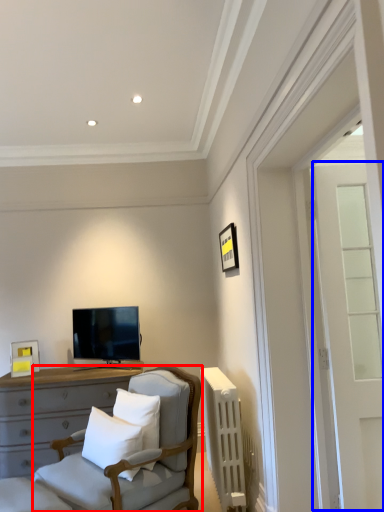
Question: Which point is closer to the camera, chair (highlighted by a red box) or glass door (highlighted by a blue box)?

Choices:
 (A) chair
 (B) glass door

Answer: (A)